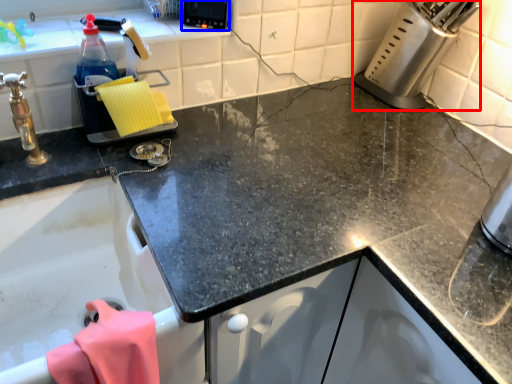
Question: Which object appears farthest to the camera in this image, appliance (highlighted by a red box) or appliance (highlighted by a blue box)?

Choices:
 (A) appliance
 (B) appliance

Answer: (B)